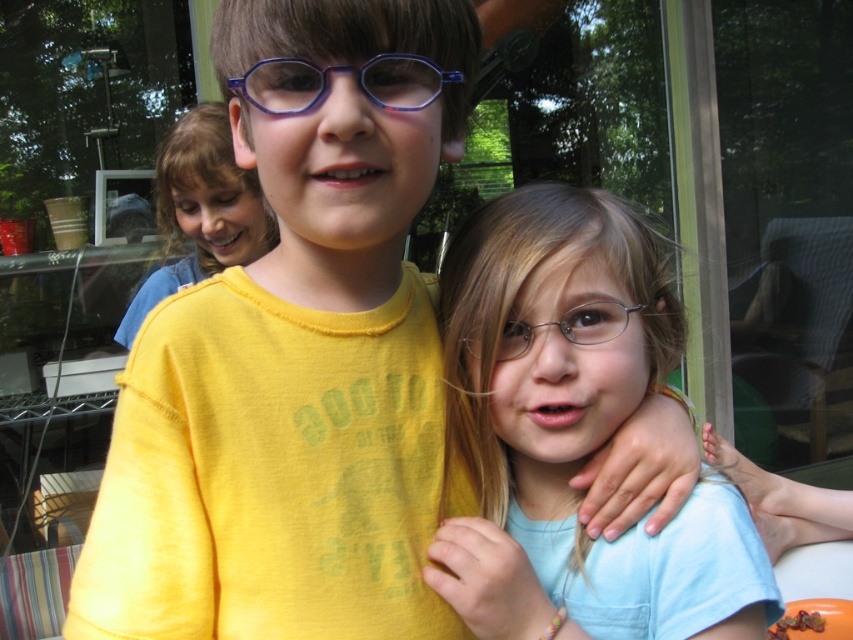
You are standing in the room and want to move from the point at coordinates point (483, 422) to the point at coordinates point (223, 179). According to the image, which direction should you move to reach your destination?

To move from point (483, 422) to point (223, 179), you should move backward since point (483, 422) is in front of point (223, 179).